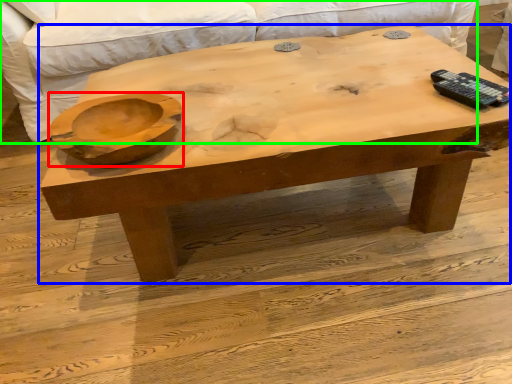
Question: Estimate the real-world distances between objects in this image. Which object is closer to bowl (highlighted by a red box), coffee table (highlighted by a blue box) or couch (highlighted by a green box)?

Choices:
 (A) coffee table
 (B) couch

Answer: (A)